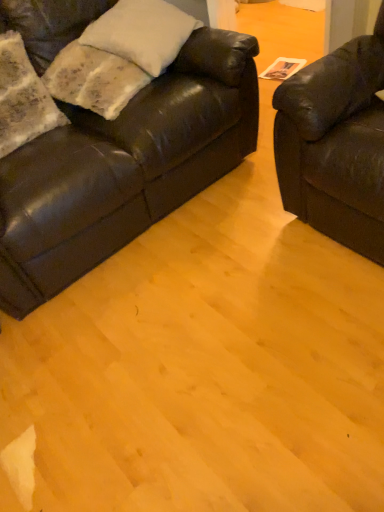
The height and width of the screenshot is (512, 384). What do you see at coordinates (124, 168) in the screenshot? I see `shiny black leather couch at left` at bounding box center [124, 168].

Identify the location of shiny black leather couch at left. (124, 168).

Where is `shiny black leather couch at left`? shiny black leather couch at left is located at coordinates (124, 168).